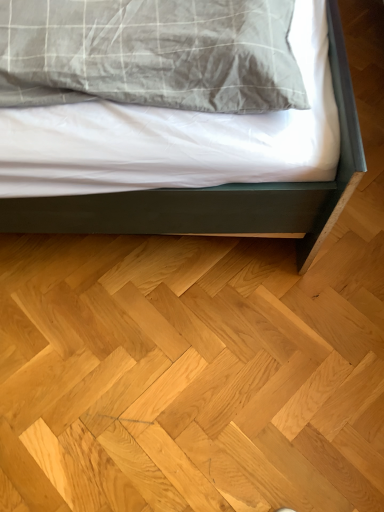
Question: Is the surface of natural wood floor at lower center in direct contact with matte gray bed at center?

Choices:
 (A) yes
 (B) no

Answer: (B)

Question: Considering the relative sizes of natural wood floor at lower center and matte gray bed at center in the image provided, is natural wood floor at lower center thinner than matte gray bed at center?

Choices:
 (A) no
 (B) yes

Answer: (A)

Question: Would you say natural wood floor at lower center contains matte gray bed at center?

Choices:
 (A) no
 (B) yes

Answer: (A)

Question: From the image's perspective, is natural wood floor at lower center on matte gray bed at center?

Choices:
 (A) no
 (B) yes

Answer: (A)

Question: Does natural wood floor at lower center have a smaller size compared to matte gray bed at center?

Choices:
 (A) yes
 (B) no

Answer: (A)

Question: From the image's perspective, does natural wood floor at lower center appear lower than matte gray bed at center?

Choices:
 (A) no
 (B) yes

Answer: (B)

Question: Is natural wood floor at lower center located within matte gray bed at center?

Choices:
 (A) no
 (B) yes

Answer: (A)

Question: Does matte gray bed at center have a greater width compared to natural wood floor at lower center?

Choices:
 (A) yes
 (B) no

Answer: (B)

Question: Is the position of matte gray bed at center more distant than that of natural wood floor at lower center?

Choices:
 (A) yes
 (B) no

Answer: (B)

Question: From a real-world perspective, is matte gray bed at center located beneath natural wood floor at lower center?

Choices:
 (A) yes
 (B) no

Answer: (B)

Question: Is matte gray bed at center far from natural wood floor at lower center?

Choices:
 (A) no
 (B) yes

Answer: (A)

Question: From the image's perspective, is matte gray bed at center over natural wood floor at lower center?

Choices:
 (A) no
 (B) yes

Answer: (B)

Question: Relative to natural wood floor at lower center, is matte gray bed at center in front or behind?

Choices:
 (A) front
 (B) behind

Answer: (A)